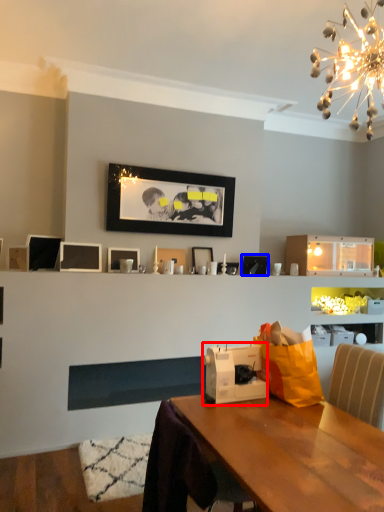
Question: Among these objects, which one is nearest to the camera, appliance (highlighted by a red box) or picture frame (highlighted by a blue box)?

Choices:
 (A) appliance
 (B) picture frame

Answer: (A)